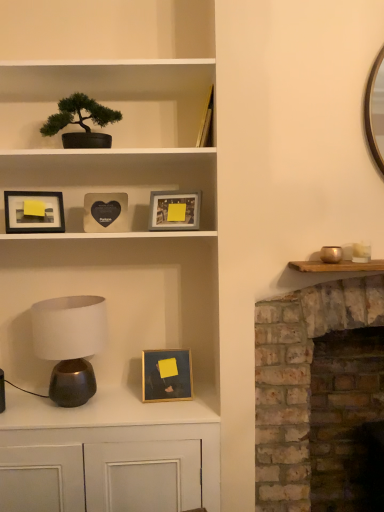
Question: Should I look upward or downward to see matte gray picture frame at upper center, which is the 2th picture frame in top-to-bottom order?

Choices:
 (A) down
 (B) up

Answer: (B)

Question: Can you confirm if matte black frame at upper left, acting as the second picture frame starting from the bottom, is thinner than matte black bonsai tree at upper left?

Choices:
 (A) yes
 (B) no

Answer: (A)

Question: From a real-world perspective, is matte black frame at upper left, placed as the 4th picture frame when sorted from right to left, physically above matte black bonsai tree at upper left?

Choices:
 (A) no
 (B) yes

Answer: (A)

Question: Does matte black frame at upper left, placed as the 4th picture frame when sorted from right to left, contain matte black bonsai tree at upper left?

Choices:
 (A) no
 (B) yes

Answer: (A)

Question: Can you confirm if matte black frame at upper left, the first picture frame when ordered from left to right, is smaller than matte black bonsai tree at upper left?

Choices:
 (A) yes
 (B) no

Answer: (A)

Question: Is matte black frame at upper left, placed as the 4th picture frame when sorted from right to left, far from matte black bonsai tree at upper left?

Choices:
 (A) no
 (B) yes

Answer: (A)

Question: From the image's perspective, is matte black frame at upper left, the first picture frame when ordered from left to right, located above matte black bonsai tree at upper left?

Choices:
 (A) no
 (B) yes

Answer: (A)

Question: From the image's perspective, is matte black frame at upper left, the first picture frame when ordered from left to right, under gold metallic bowl at right?

Choices:
 (A) yes
 (B) no

Answer: (B)

Question: Does matte black frame at upper left, acting as the second picture frame starting from the bottom, have a smaller size compared to gold metallic bowl at right?

Choices:
 (A) no
 (B) yes

Answer: (A)

Question: Is matte black frame at upper left, placed as the 4th picture frame when sorted from right to left, wider than gold metallic bowl at right?

Choices:
 (A) no
 (B) yes

Answer: (A)

Question: From a real-world perspective, is matte black frame at upper left, the 3th picture frame in the top-to-bottom sequence, beneath gold metallic bowl at right?

Choices:
 (A) no
 (B) yes

Answer: (A)

Question: From a real-world perspective, does matte black frame at upper left, placed as the 4th picture frame when sorted from right to left, stand above gold metallic bowl at right?

Choices:
 (A) no
 (B) yes

Answer: (B)

Question: Is matte black frame at upper left, the first picture frame when ordered from left to right, at the left side of gold metallic bowl at right?

Choices:
 (A) yes
 (B) no

Answer: (A)

Question: Is matte gray picture frame at upper center, which is the 2th picture frame in top-to-bottom order, at the right side of brick fireplace at right?

Choices:
 (A) no
 (B) yes

Answer: (A)